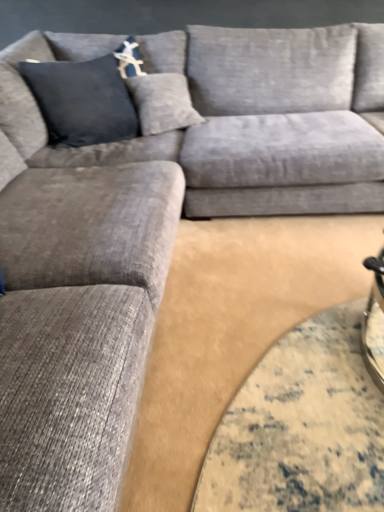
Question: Is dark blue fabric pillow at upper left oriented away from textured gray couch at center?

Choices:
 (A) no
 (B) yes

Answer: (A)

Question: Is dark blue fabric pillow at upper left not inside textured gray couch at center?

Choices:
 (A) yes
 (B) no

Answer: (A)

Question: Can you confirm if dark blue fabric pillow at upper left is smaller than textured gray couch at center?

Choices:
 (A) yes
 (B) no

Answer: (A)

Question: Does dark blue fabric pillow at upper left have a greater height compared to textured gray couch at center?

Choices:
 (A) yes
 (B) no

Answer: (B)

Question: From a real-world perspective, does dark blue fabric pillow at upper left sit lower than textured gray couch at center?

Choices:
 (A) yes
 (B) no

Answer: (B)

Question: Considering the relative sizes of dark blue fabric pillow at upper left and textured gray couch at center in the image provided, is dark blue fabric pillow at upper left shorter than textured gray couch at center?

Choices:
 (A) no
 (B) yes

Answer: (B)

Question: From a real-world perspective, is textured gray couch at center positioned under dark blue fabric pillow at upper left based on gravity?

Choices:
 (A) yes
 (B) no

Answer: (A)

Question: Considering the relative sizes of textured gray couch at center and dark blue fabric pillow at upper left in the image provided, is textured gray couch at center shorter than dark blue fabric pillow at upper left?

Choices:
 (A) yes
 (B) no

Answer: (B)

Question: Considering the relative positions of textured gray couch at center and dark blue fabric pillow at upper left in the image provided, is textured gray couch at center to the left of dark blue fabric pillow at upper left from the viewer's perspective?

Choices:
 (A) no
 (B) yes

Answer: (A)

Question: Does textured gray couch at center have a smaller size compared to dark blue fabric pillow at upper left?

Choices:
 (A) yes
 (B) no

Answer: (B)

Question: Is textured gray couch at center placed right next to dark blue fabric pillow at upper left?

Choices:
 (A) yes
 (B) no

Answer: (B)

Question: Are textured gray couch at center and dark blue fabric pillow at upper left far apart?

Choices:
 (A) yes
 (B) no

Answer: (B)

Question: Relative to textured gray couch at center, is dark blue fabric pillow at upper left in front or behind?

Choices:
 (A) front
 (B) behind

Answer: (B)